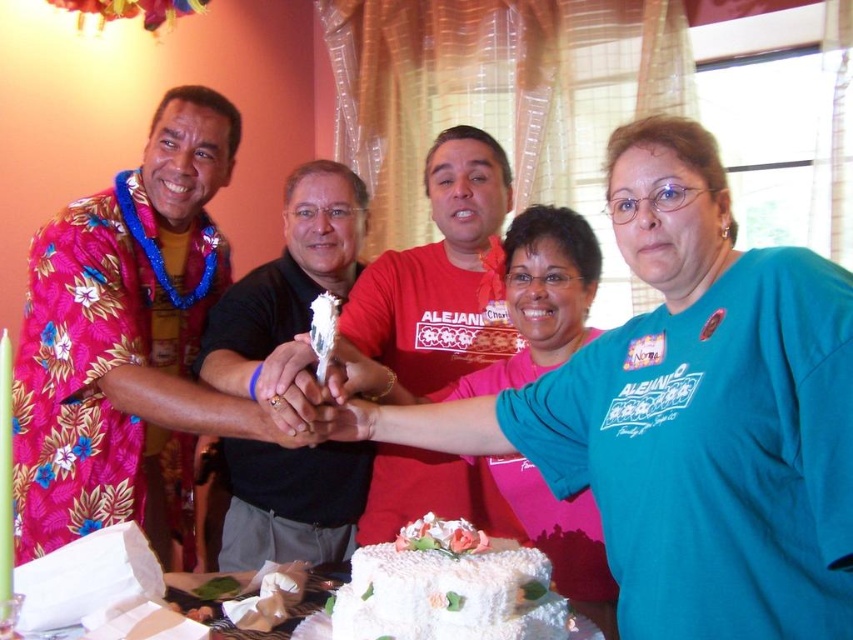
Between black matte shirt at center and white frosted cake at center, which one is positioned lower?

white frosted cake at center

Which is in front, point (344, 284) or point (469, 554)?

Point (469, 554) is more forward.

Find the location of a particular element. This screenshot has width=853, height=640. black matte shirt at center is located at coordinates (287, 276).

Is the position of floral print shirt at left more distant than that of black matte shirt at center?

That is True.

Which is more to the right, floral print shirt at left or black matte shirt at center?

black matte shirt at center

Which is in front, point (148, 262) or point (289, 529)?

Point (148, 262) is in front.

This screenshot has height=640, width=853. I want to click on floral print shirt at left, so click(126, 344).

Which is above, matte red shirt at center or black matte shirt at center?

Positioned higher is black matte shirt at center.

Can you confirm if matte red shirt at center is positioned to the right of black matte shirt at center?

Indeed, matte red shirt at center is positioned on the right side of black matte shirt at center.

Does point (427, 481) lie in front of point (329, 500)?

Yes, it is in front of point (329, 500).

What are the coordinates of `matte red shirt at center` in the screenshot? It's located at (440, 276).